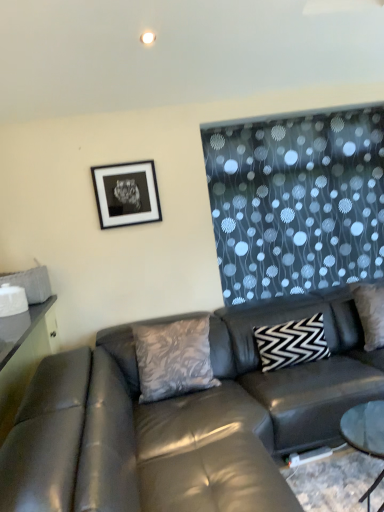
Question: Is black matte picture frame at upper left located outside leather couch at center?

Choices:
 (A) yes
 (B) no

Answer: (A)

Question: Can you confirm if black matte picture frame at upper left is smaller than leather couch at center?

Choices:
 (A) no
 (B) yes

Answer: (B)

Question: From a real-world perspective, is black matte picture frame at upper left on leather couch at center?

Choices:
 (A) yes
 (B) no

Answer: (A)

Question: Does black matte picture frame at upper left have a greater width compared to leather couch at center?

Choices:
 (A) yes
 (B) no

Answer: (B)

Question: From a real-world perspective, is black matte picture frame at upper left positioned under leather couch at center based on gravity?

Choices:
 (A) yes
 (B) no

Answer: (B)

Question: Is leather couch at center in front of or behind black matte picture frame at upper left in the image?

Choices:
 (A) behind
 (B) front

Answer: (B)

Question: Considering the positions of point (220, 361) and point (134, 206), is point (220, 361) closer or farther from the camera than point (134, 206)?

Choices:
 (A) closer
 (B) farther

Answer: (A)

Question: From a real-world perspective, is leather couch at center physically located above or below black matte picture frame at upper left?

Choices:
 (A) above
 (B) below

Answer: (B)

Question: Do you think leather couch at center is within black matte picture frame at upper left, or outside of it?

Choices:
 (A) outside
 (B) inside

Answer: (A)

Question: Does point (142, 394) appear closer or farther from the camera than point (107, 215)?

Choices:
 (A) closer
 (B) farther

Answer: (A)

Question: Would you say silky gray pillow at center, which ranks as the first pillow in left-to-right order, is inside or outside black matte picture frame at upper left?

Choices:
 (A) outside
 (B) inside

Answer: (A)

Question: Based on their sizes in the image, would you say silky gray pillow at center, which ranks as the first pillow in left-to-right order, is bigger or smaller than black matte picture frame at upper left?

Choices:
 (A) small
 (B) big

Answer: (B)

Question: Relative to black matte picture frame at upper left, is silky gray pillow at center, positioned as the 2th pillow in right-to-left order, in front or behind?

Choices:
 (A) front
 (B) behind

Answer: (A)

Question: From the image's perspective, is leather couch at center above or below matte black swivel chair at left?

Choices:
 (A) below
 (B) above

Answer: (B)

Question: Is point (244, 347) positioned closer to the camera than point (77, 443)?

Choices:
 (A) farther
 (B) closer

Answer: (A)